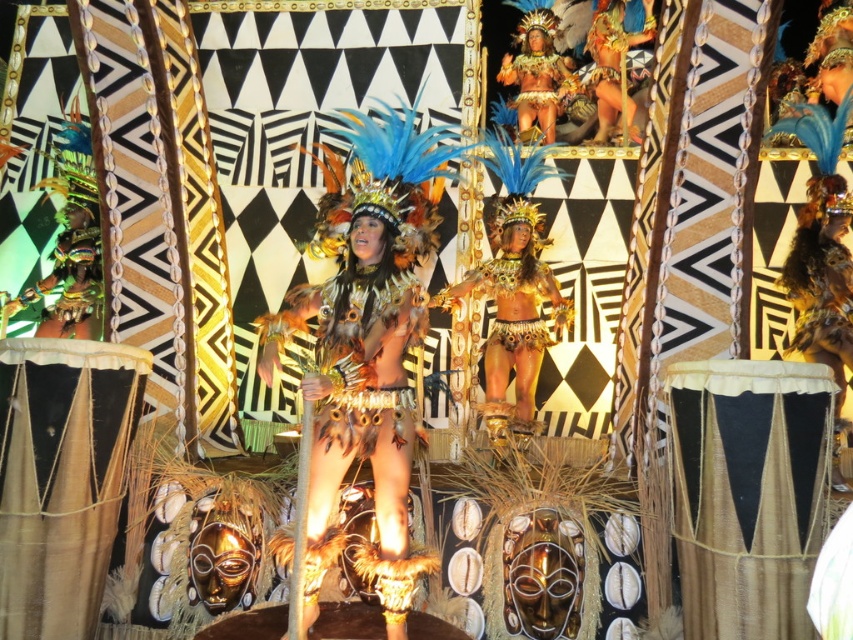
You are a photographer at the event and want to capture a clear photo of the feathered gold costume at center and the gold metallic headdress at upper center. However, you notice that one is blocking the other. Which object is blocking the other?

The feathered gold costume at center is blocking the gold metallic headdress at upper center because it is positioned in front of it.